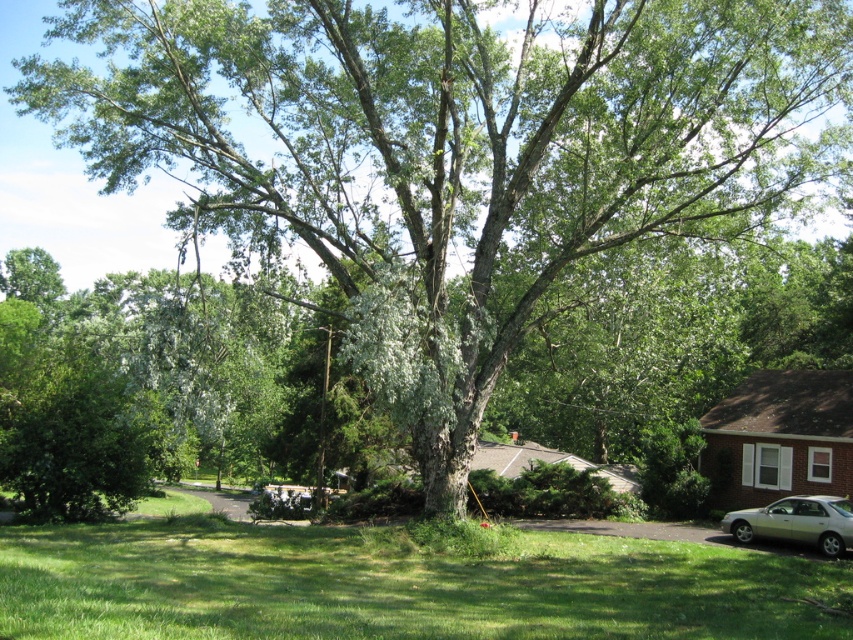
Does green grass at lower center have a greater height compared to silver metallic car at lower right?

Yes, green grass at lower center is taller than silver metallic car at lower right.

Does green grass at lower center appear on the right side of silver metallic car at lower right?

No, green grass at lower center is not to the right of silver metallic car at lower right.

The height and width of the screenshot is (640, 853). Identify the location of green grass at lower center. (396, 584).

Image resolution: width=853 pixels, height=640 pixels. What are the coordinates of `green grass at lower center` in the screenshot? It's located at (396, 584).